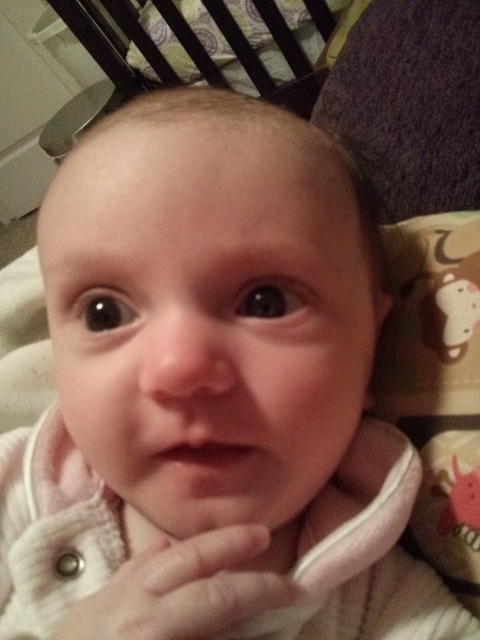
Question: Can you confirm if white soft fabric hand at center is thinner than wooden slats at upper center?

Choices:
 (A) yes
 (B) no

Answer: (A)

Question: Can you confirm if white soft fabric hand at center is positioned above wooden slats at upper center?

Choices:
 (A) no
 (B) yes

Answer: (A)

Question: Does white soft fabric hand at center have a lesser width compared to wooden slats at upper center?

Choices:
 (A) no
 (B) yes

Answer: (B)

Question: Which object is farther from the camera taking this photo?

Choices:
 (A) wooden slats at upper center
 (B) white soft fabric hand at center

Answer: (A)

Question: Which point is farther to the camera?

Choices:
 (A) wooden slats at upper center
 (B) white soft fabric hand at center

Answer: (A)